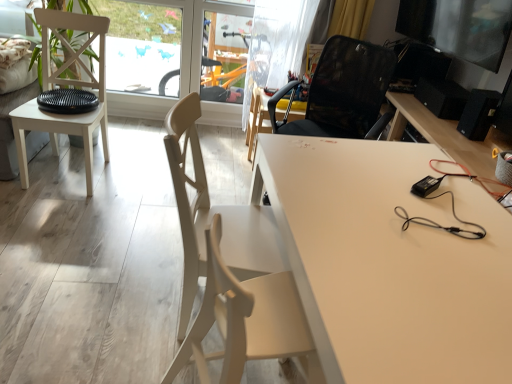
Question: Considering their positions, is white matte desk at center located in front of or behind white matte chair at left, which appears as the third chair when viewed from the front?

Choices:
 (A) behind
 (B) front

Answer: (B)

Question: Is white matte desk at center inside the boundaries of white matte chair at left, which is the second chair from back to front, or outside?

Choices:
 (A) outside
 (B) inside

Answer: (A)

Question: Which is nearer to the white matte chair at left, which appears as the third chair when viewed from the front?

Choices:
 (A) white matte desk at center
 (B) transparent plastic screen door at upper center
 (C) matte white chair at center, marked as the third chair in a back-to-front arrangement
 (D) black mesh chair at center, placed as the 4th chair when sorted from front to back
 (E) light beige wood chair at center, acting as the first chair starting from the front

Answer: (B)

Question: Considering the real-world distances, which object is farthest from the metallic glossy monitor at upper right?

Choices:
 (A) white matte chair at left, which appears as the third chair when viewed from the front
 (B) black mesh chair at center, which appears as the first chair when viewed from the back
 (C) light beige wood chair at center, acting as the first chair starting from the front
 (D) black matte speaker at right
 (E) matte white chair at center, marked as the third chair in a back-to-front arrangement

Answer: (A)